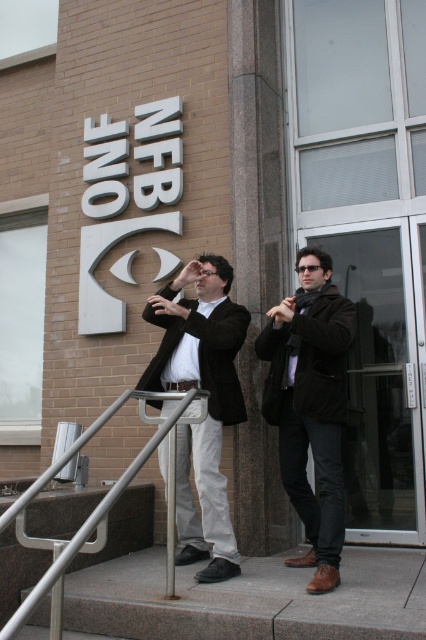
You are a photographer standing at the center of the image. You need to position a tripod so that it is exactly halfway between the point marked by coordinates point (310, 404) and the edge of the image. Where should you place the tripod?

The point (310, 404) marks the velvet brown coat at center. To place the tripod exactly halfway between this point and the edge of the image, you would position it at the midpoint between the velvet brown coat at center and the nearest edge, ensuring it is equidistant from both.

You are a photographer setting up for a shoot. You notice two coats in the scene. Which coat, the velvet brown coat at center or the matte black jacket at center, is positioned to the right of the other?

The velvet brown coat at center is positioned to the right of the matte black jacket at center.

You are a photographer setting up for a shoot. You need to position the matte black jacket at center and the silver metallic handrail at lower center in your frame. Which object is narrower in the image?

The matte black jacket at center is narrower than the silver metallic handrail at lower center.